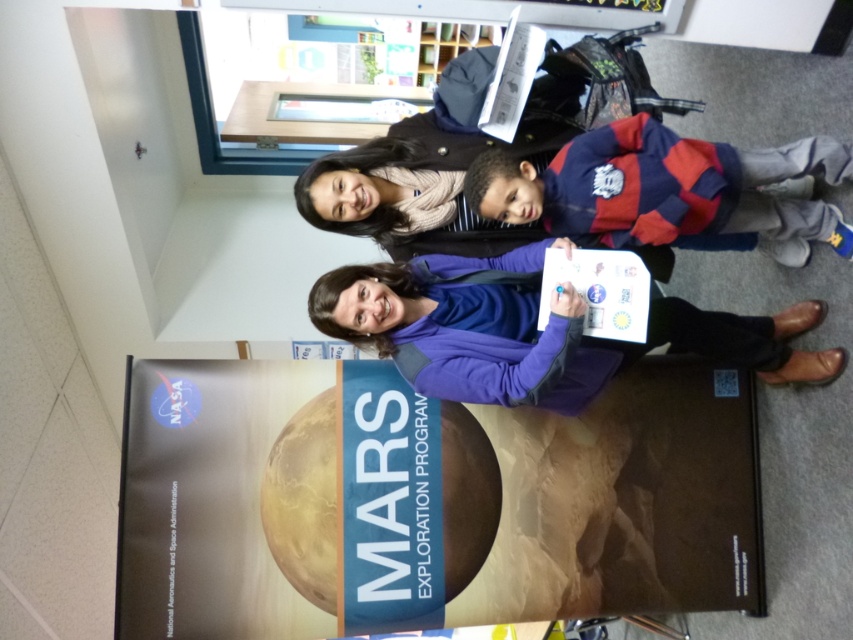
Does striped fleece jacket at center lie in front of transparent glass table at upper center?

Yes, striped fleece jacket at center is closer to the viewer.

Can you confirm if striped fleece jacket at center is positioned to the left of transparent glass table at upper center?

In fact, striped fleece jacket at center is to the right of transparent glass table at upper center.

The image size is (853, 640). I want to click on striped fleece jacket at center, so click(x=662, y=188).

The image size is (853, 640). Identify the location of striped fleece jacket at center. 662,188.

Find the location of a particular element. purple fabric jacket at center is located at coordinates (535, 330).

Is purple fabric jacket at center wider than striped fleece jacket at center?

Correct, the width of purple fabric jacket at center exceeds that of striped fleece jacket at center.

Does point (358, 332) lie behind point (488, 156)?

Yes, point (358, 332) is behind point (488, 156).

The width and height of the screenshot is (853, 640). What are the coordinates of `purple fabric jacket at center` in the screenshot? It's located at (535, 330).

Is purple fabric jacket at center closer to the viewer compared to transparent glass table at upper center?

Yes, it is in front of transparent glass table at upper center.

Which is in front, point (614, 340) or point (236, 113)?

Point (614, 340)

Does point (392, 284) lie behind point (390, 97)?

No, it is in front of (390, 97).

I want to click on purple fabric jacket at center, so click(x=535, y=330).